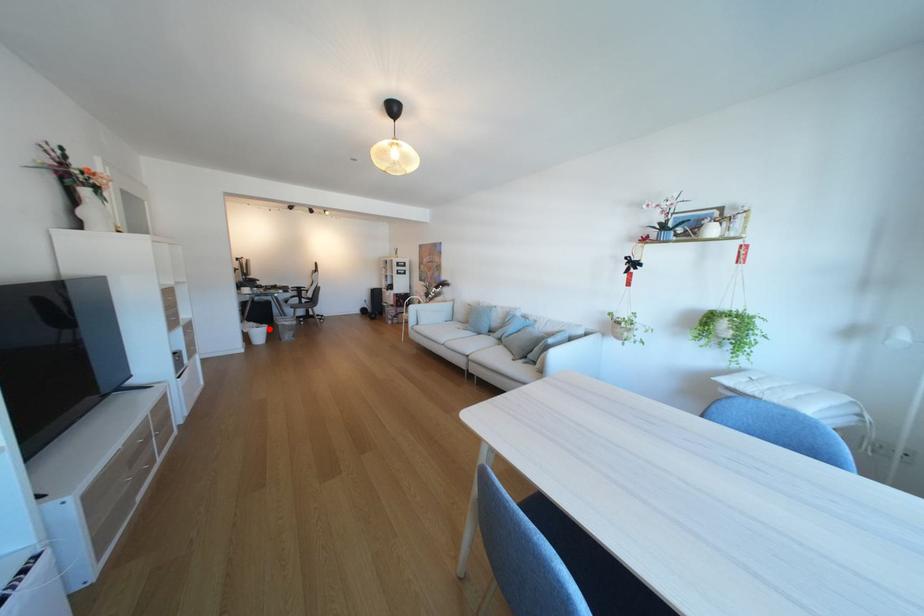
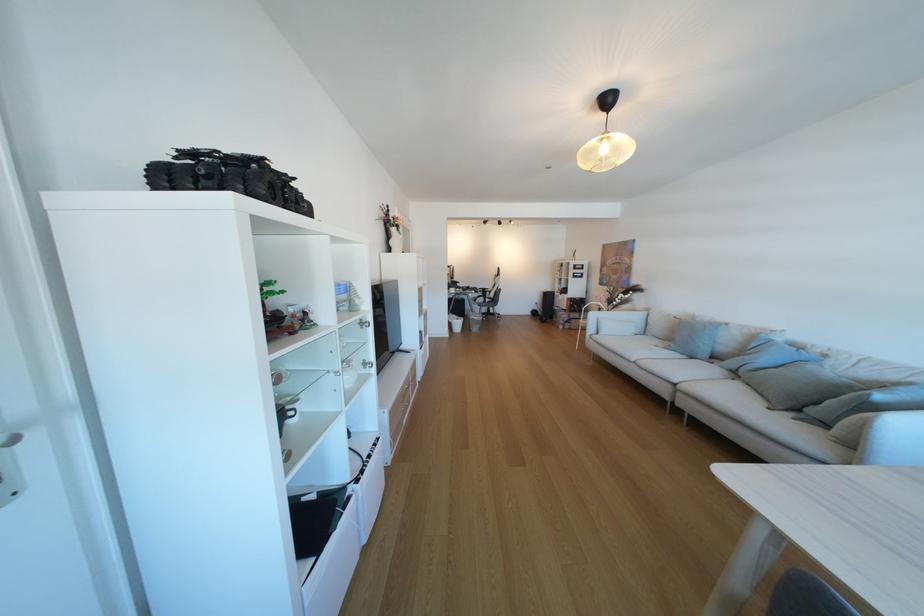
Find the pixel in the second image that matches the highlighted location in the first image.

(468, 321)